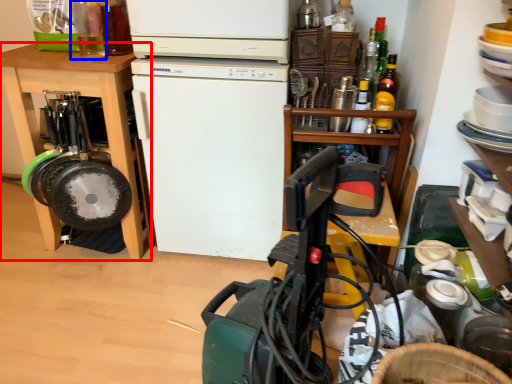
Question: Which of the following is the farthest to the observer, cabinetry (highlighted by a red box) or bottle (highlighted by a blue box)?

Choices:
 (A) cabinetry
 (B) bottle

Answer: (A)